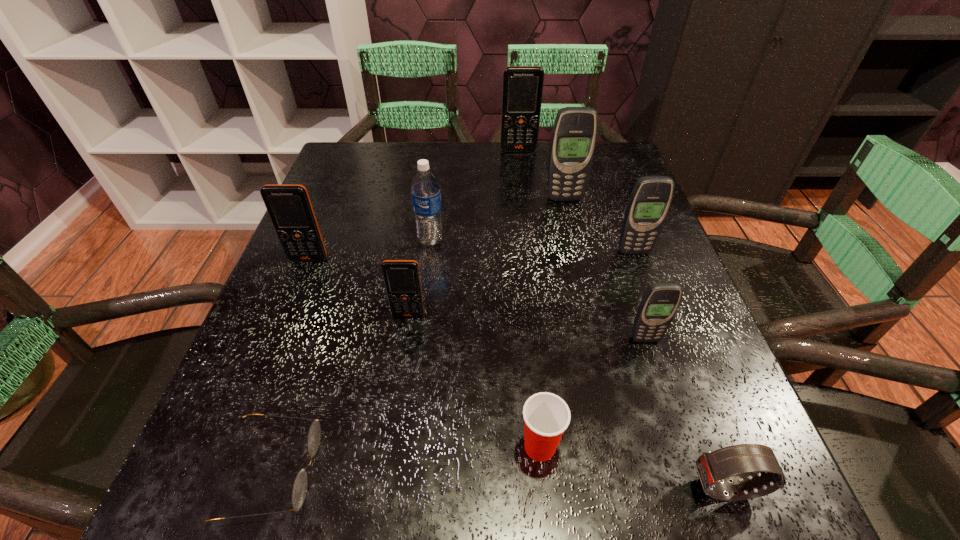
You are a GUI agent. You are given a task and a screenshot of the screen. Output one action in this format:
    pyautogui.click(x=<x>, y=<y>)
    Task: Click on the vacant space at the right edge
    This screenshot has height=540, width=960.
    Given the screenshot: What is the action you would take?
    pyautogui.click(x=641, y=260)

Image resolution: width=960 pixels, height=540 pixels. I want to click on blank space at the far left corner of the desktop, so click(355, 147).

Locate an element on the screen. vacant space at the near left corner of the desktop is located at coordinates (206, 497).

This screenshot has height=540, width=960. In order to click on vacant position at the far right corner of the desktop in this screenshot , I will do point(602,174).

I want to click on unoccupied area between the water bottle and the second nearest gray cellular telephone, so click(x=532, y=246).

This screenshot has width=960, height=540. In order to click on vacant space that's between the second farthest orange cellular telephone and the red Dixie cup in this screenshot , I will do `click(424, 353)`.

The image size is (960, 540). I want to click on vacant space in between the second smallest orange cellular telephone and the shortest object, so click(x=290, y=365).

In order to click on free spot between the second smallest gray cellular telephone and the spectacles in this screenshot , I will do `click(453, 361)`.

Find the location of `free spot between the Dixie cup and the nearest gray cellular telephone`. free spot between the Dixie cup and the nearest gray cellular telephone is located at coordinates (592, 393).

Identify the location of free space between the watch and the red Dixie cup. This screenshot has height=540, width=960. (633, 468).